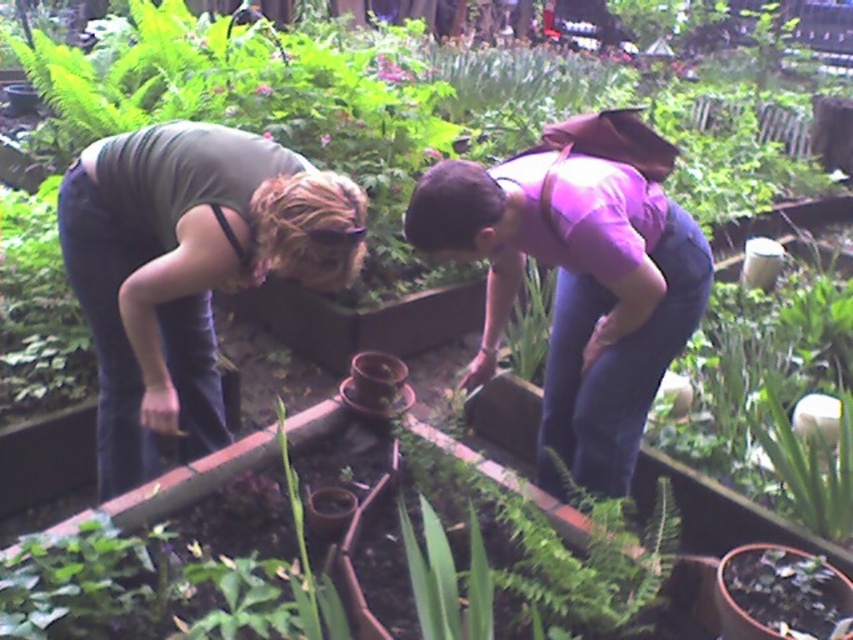
You are standing in the garden and want to water the green matte plant at center. The matte green shirt at left is in your way. Can you move around the plant to reach the other side?

The matte green shirt at left is to the left of the green matte plant at center, so you can move around the right side of the plant to reach the other side.

You are a drone operator trying to capture a photo of the garden scene. You need to ensure both the matte green shirt at left and the purple matte shirt at center are visible in the frame. Based on their positions, which shirt will appear higher in the photo?

The matte green shirt at left will appear higher in the photo because it is located above the purple matte shirt at center.

You are a photographer trying to capture a closeup of the green matte plant at center. The purple matte shirt at center is blocking your view. Can you estimate whether the shirt is wider than the plant, making it harder to move around it to get a clear shot?

The purple matte shirt at center is wider than the green matte plant at center, so it would be harder to move around it to get a clear shot.